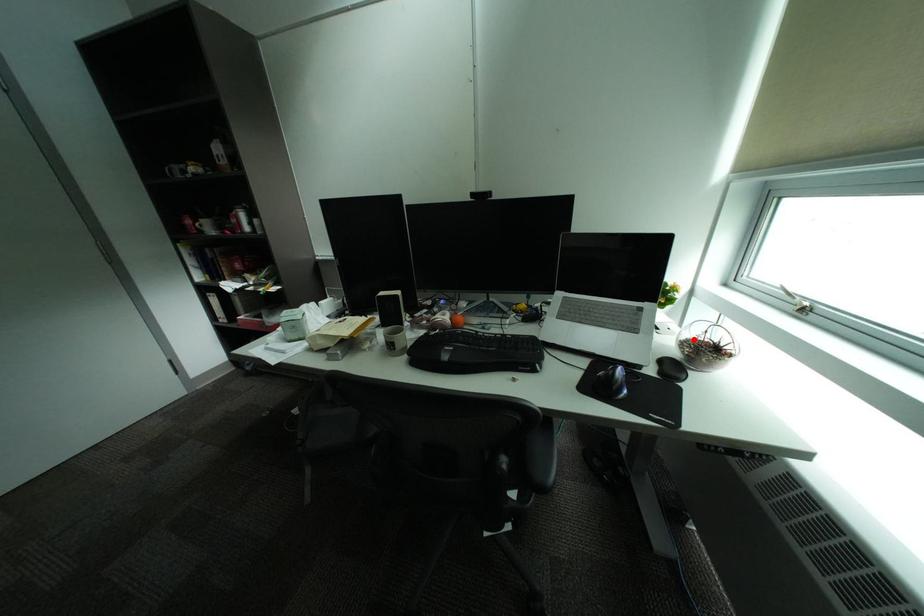
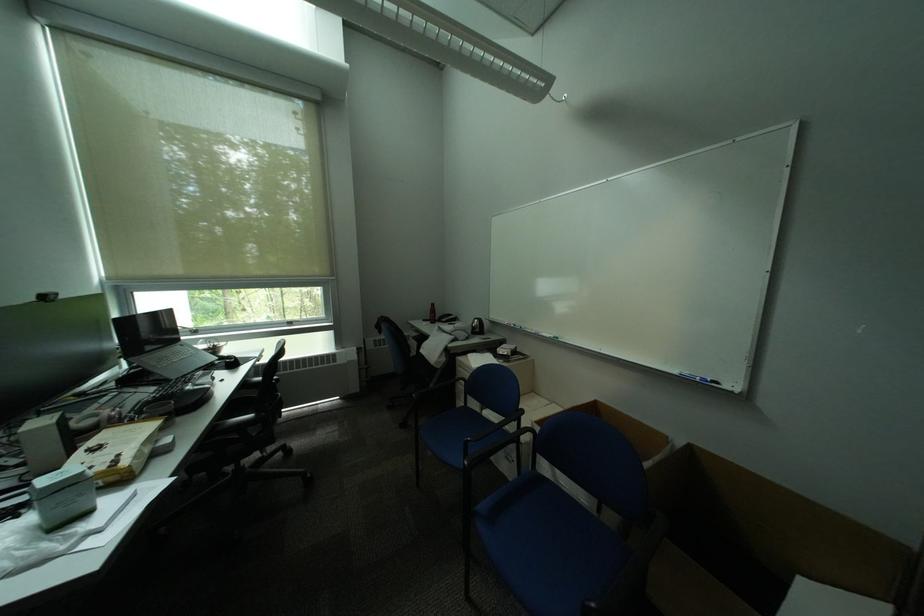
Question: I am providing you with two images of the same scene from different viewpoints. A red point is marked on the first image. At the location where the point appears in image 1, is it still visible in image 2?

Choices:
 (A) Yes
 (B) No

Answer: (B)